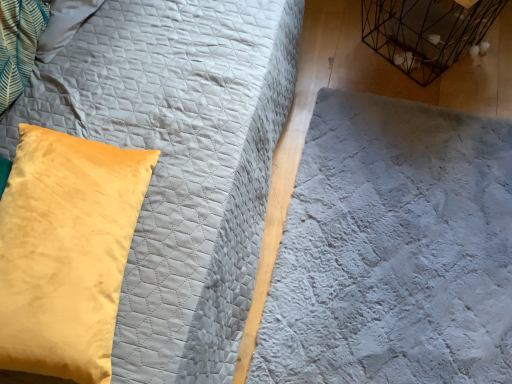
Question: From the image's perspective, does white quilted fabric at center appear higher than black wire birdcage at upper right?

Choices:
 (A) yes
 (B) no

Answer: (B)

Question: Is white quilted fabric at center taller than black wire birdcage at upper right?

Choices:
 (A) no
 (B) yes

Answer: (A)

Question: Is white quilted fabric at center facing towards black wire birdcage at upper right?

Choices:
 (A) yes
 (B) no

Answer: (B)

Question: Is white quilted fabric at center at the left side of black wire birdcage at upper right?

Choices:
 (A) no
 (B) yes

Answer: (B)

Question: Is black wire birdcage at upper right surrounded by white quilted fabric at center?

Choices:
 (A) no
 (B) yes

Answer: (A)

Question: Is white quilted fabric at center smaller than black wire birdcage at upper right?

Choices:
 (A) yes
 (B) no

Answer: (B)

Question: Can you confirm if black wire birdcage at upper right is thinner than white quilted fabric at center?

Choices:
 (A) no
 (B) yes

Answer: (B)

Question: Is black wire birdcage at upper right shorter than white quilted fabric at center?

Choices:
 (A) yes
 (B) no

Answer: (B)

Question: Does black wire birdcage at upper right have a greater width compared to white quilted fabric at center?

Choices:
 (A) no
 (B) yes

Answer: (A)

Question: From a real-world perspective, is black wire birdcage at upper right over white quilted fabric at center?

Choices:
 (A) yes
 (B) no

Answer: (A)

Question: Is black wire birdcage at upper right closer to the viewer compared to white quilted fabric at center?

Choices:
 (A) yes
 (B) no

Answer: (B)

Question: Does black wire birdcage at upper right appear on the right side of white quilted fabric at center?

Choices:
 (A) no
 (B) yes

Answer: (B)

Question: Is velvet yellow pillow at left positioned beyond the bounds of black wire birdcage at upper right?

Choices:
 (A) yes
 (B) no

Answer: (A)